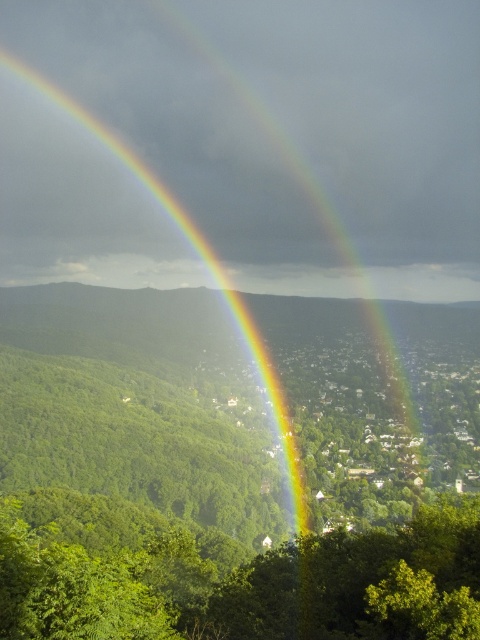
Between green leafy tree at center and rainbow at center, which one is positioned lower?

→ green leafy tree at center is below.

Does green leafy tree at center have a lesser width compared to rainbow at center?

No, green leafy tree at center is not thinner than rainbow at center.

Is point (15, 500) closer to viewer compared to point (276, 380)?

Yes.

This screenshot has width=480, height=640. I want to click on green leafy tree at center, so click(230, 576).